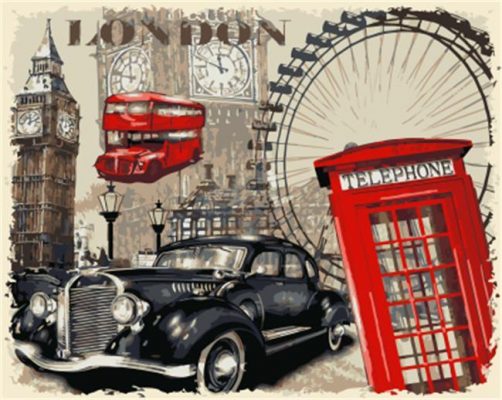
Image resolution: width=502 pixels, height=400 pixels. I want to click on clock, so click(23, 124).